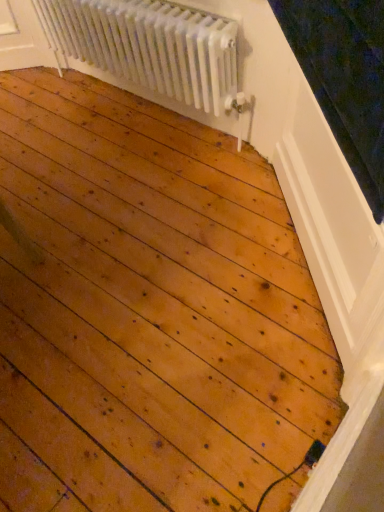
Question: Is wooden at lower right bigger or smaller than white metallic radiator at upper center?

Choices:
 (A) small
 (B) big

Answer: (A)

Question: In the image, is wooden at lower right positioned in front of or behind white metallic radiator at upper center?

Choices:
 (A) front
 (B) behind

Answer: (A)

Question: Which is correct: wooden at lower right is inside white metallic radiator at upper center, or outside of it?

Choices:
 (A) inside
 (B) outside

Answer: (B)

Question: Looking at their shapes, would you say white metallic radiator at upper center is wider or thinner than wooden at lower right?

Choices:
 (A) wide
 (B) thin

Answer: (A)

Question: From a real-world perspective, is white metallic radiator at upper center positioned above or below wooden at lower right?

Choices:
 (A) above
 (B) below

Answer: (A)

Question: Based on their sizes in the image, would you say white metallic radiator at upper center is bigger or smaller than wooden at lower right?

Choices:
 (A) big
 (B) small

Answer: (A)

Question: Is white metallic radiator at upper center spatially inside wooden at lower right, or outside of it?

Choices:
 (A) inside
 (B) outside

Answer: (B)